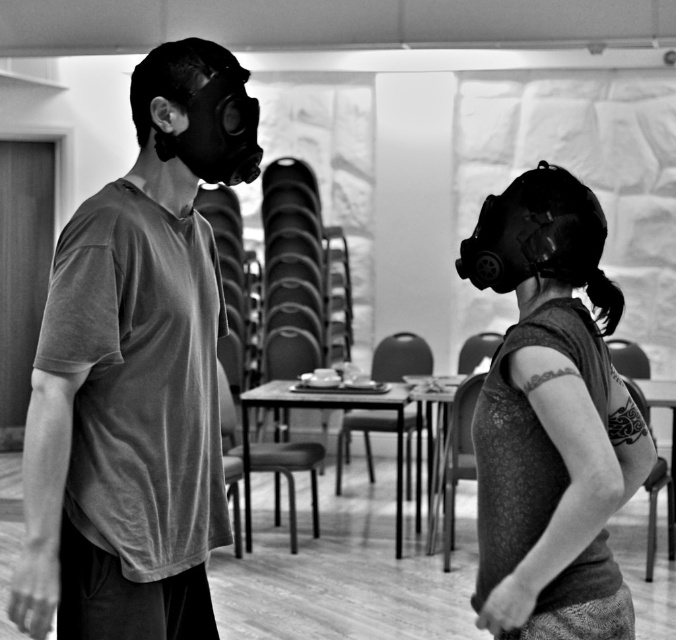
Question: Can you confirm if matte gray t-shirt at left is positioned below matte black gas mask at center?

Choices:
 (A) yes
 (B) no

Answer: (B)

Question: Which point appears farthest from the camera in this image?

Choices:
 (A) (197, 289)
 (B) (589, 241)

Answer: (A)

Question: Which object is farther from the camera taking this photo?

Choices:
 (A) matte black gas mask at center
 (B) matte gray t-shirt at left

Answer: (B)

Question: Is the position of matte gray t-shirt at left less distant than that of matte black gas mask at center?

Choices:
 (A) yes
 (B) no

Answer: (B)

Question: Does matte gray t-shirt at left have a greater width compared to matte black gas mask at center?

Choices:
 (A) yes
 (B) no

Answer: (A)